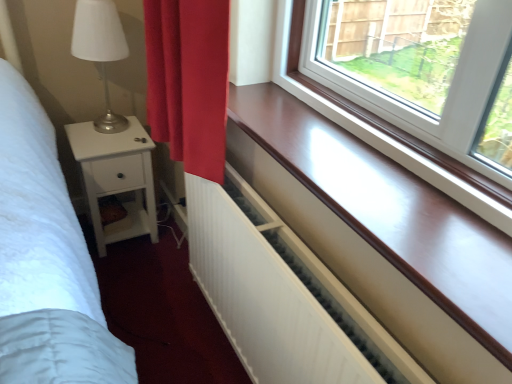
Question: From the image's perspective, is white matte radiator at lower center positioned above or below smooth wood window sill at center?

Choices:
 (A) below
 (B) above

Answer: (A)

Question: Considering their positions, is white matte radiator at lower center located in front of or behind smooth wood window sill at center?

Choices:
 (A) behind
 (B) front

Answer: (A)

Question: Considering the real-world distances, which object is farthest from the matte silver table lamp at left?

Choices:
 (A) smooth wood window sill at center
 (B) white matte radiator at lower center
 (C) white wood nightstand at left

Answer: (A)

Question: Which object is the closest to the matte silver table lamp at left?

Choices:
 (A) white wood nightstand at left
 (B) white matte radiator at lower center
 (C) smooth wood window sill at center

Answer: (A)